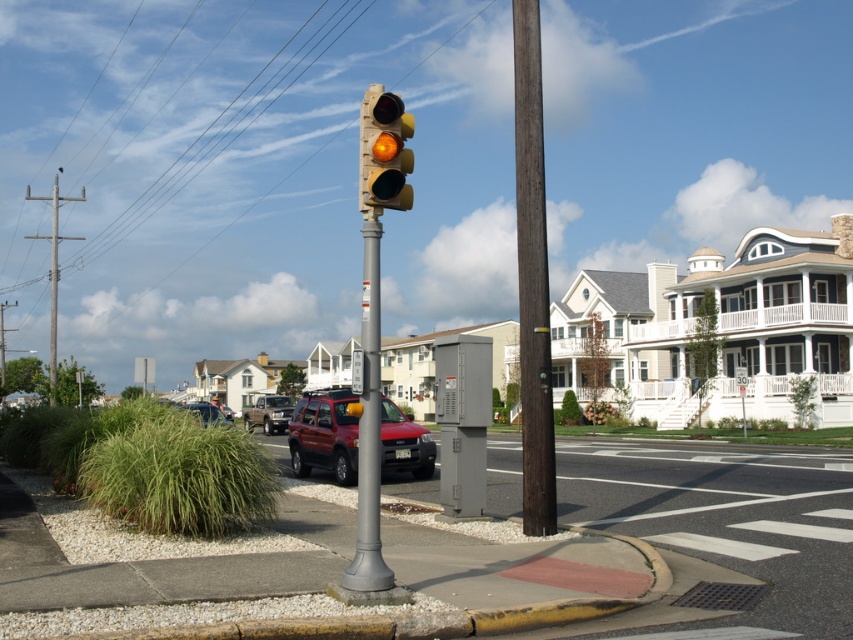
You are a pedestrian waiting at the crosswalk. You see the matte brown suv at center and the metallic rectangular sign at center. Which object is closer to the ground?

The matte brown suv at center is closer to the ground because it is below the metallic rectangular sign at center.

You are a pedestrian waiting at the crosswalk. You see the shiny red suv at center and the metallic rectangular sign at center. Which object is closer to the ground?

The shiny red suv at center is below the metallic rectangular sign at center, so it is closer to the ground.